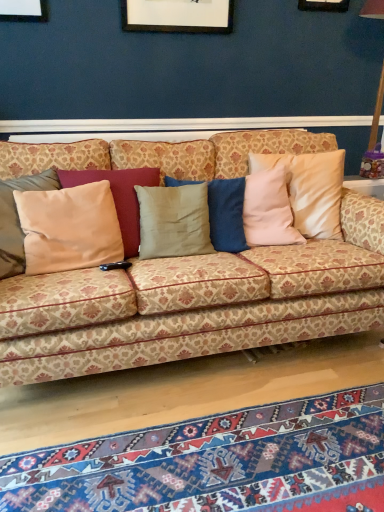
At what (x,y) coordinates should I click in order to perform the action: click on textured wool mat at lower center. Please return your answer as a coordinate pair (x, y). The image size is (384, 512). Looking at the image, I should click on (216, 462).

What is the approximate height of patterned fabric couch at center?

35.84 inches.

At what (x,y) coordinates should I click in order to perform the action: click on textured wool mat at lower center. Please return your answer as a coordinate pair (x, y). The image size is (384, 512). Looking at the image, I should click on (216, 462).

From the image's perspective, would you say textured wool mat at lower center is positioned over patterned fabric couch at center?

Actually, textured wool mat at lower center appears below patterned fabric couch at center in the image.

Measure the distance between textured wool mat at lower center and patterned fabric couch at center.

A distance of 18.14 inches exists between textured wool mat at lower center and patterned fabric couch at center.

Between textured wool mat at lower center and patterned fabric couch at center, which one has larger size?

Bigger between the two is patterned fabric couch at center.

In the image, is textured wool mat at lower center on the left side or the right side of patterned fabric couch at center?

Clearly, textured wool mat at lower center is on the right of patterned fabric couch at center in the image.

Considering their positions, is satin beige pillow at left located in front of or behind patterned fabric couch at center?

In the image, satin beige pillow at left appears behind patterned fabric couch at center.

From a real-world perspective, who is located higher, satin beige pillow at left or patterned fabric couch at center?

satin beige pillow at left.

Between point (58, 221) and point (57, 362), which one is positioned in front?

Point (57, 362)

Does point (262, 419) appear closer or farther from the camera than point (36, 198)?

Clearly, point (262, 419) is closer to the camera than point (36, 198).

Can you confirm if textured wool mat at lower center is wider than satin beige pillow at left?

Yes.

Is textured wool mat at lower center taller than satin beige pillow at left?

No, textured wool mat at lower center is not taller than satin beige pillow at left.

Can you tell me how much textured wool mat at lower center and satin beige pillow at left differ in facing direction?

The angular difference between textured wool mat at lower center and satin beige pillow at left is 178 degrees.

How far apart are satin beige pillow at left and textured wool mat at lower center?

34.28 inches.

Is satin beige pillow at left wider than textured wool mat at lower center?

In fact, satin beige pillow at left might be narrower than textured wool mat at lower center.

Do you think satin beige pillow at left is within textured wool mat at lower center, or outside of it?

The correct answer is: outside.

The height and width of the screenshot is (512, 384). What are the coordinates of `mat lying in front of the satin beige pillow at left` in the screenshot? It's located at (216, 462).

Could you tell me if patterned fabric couch at center is turned towards satin beige pillow at left?

Yes, patterned fabric couch at center is oriented towards satin beige pillow at left.

Is patterned fabric couch at center surrounding satin beige pillow at left?

Yes, patterned fabric couch at center is surrounding satin beige pillow at left.

From a real-world perspective, is patterned fabric couch at center above or below satin beige pillow at left?

patterned fabric couch at center is below satin beige pillow at left.

Which is more to the right, patterned fabric couch at center or textured wool mat at lower center?

textured wool mat at lower center.

Can you confirm if patterned fabric couch at center is bigger than textured wool mat at lower center?

Indeed, patterned fabric couch at center has a larger size compared to textured wool mat at lower center.

From the image's perspective, is patterned fabric couch at center below textured wool mat at lower center?

No.

Where is `studio couch behind the textured wool mat at lower center`? Image resolution: width=384 pixels, height=512 pixels. studio couch behind the textured wool mat at lower center is located at coordinates click(x=194, y=304).

Identify the location of pillow that appears on the left of patterned fabric couch at center. Image resolution: width=384 pixels, height=512 pixels. (69, 228).

Based on their spatial positions, is satin beige pillow at left or textured wool mat at lower center further from patterned fabric couch at center?

textured wool mat at lower center is positioned further to the anchor patterned fabric couch at center.

From the image, which object appears to be farther from textured wool mat at lower center, patterned fabric couch at center or satin beige pillow at left?

satin beige pillow at left is further to textured wool mat at lower center.

When comparing their distances from satin beige pillow at left, does patterned fabric couch at center or textured wool mat at lower center seem further?

Based on the image, textured wool mat at lower center appears to be further to satin beige pillow at left.

Looking at the image, which one is located further to patterned fabric couch at center, textured wool mat at lower center or satin beige pillow at left?

Based on the image, textured wool mat at lower center appears to be further to patterned fabric couch at center.

Looking at the image, which one is located closer to textured wool mat at lower center, satin beige pillow at left or patterned fabric couch at center?

Based on the image, patterned fabric couch at center appears to be nearer to textured wool mat at lower center.

Considering their positions, is textured wool mat at lower center positioned closer to satin beige pillow at left than patterned fabric couch at center?

patterned fabric couch at center.

This screenshot has width=384, height=512. What are the coordinates of `studio couch between satin beige pillow at left and textured wool mat at lower center in the vertical direction` in the screenshot? It's located at (194, 304).